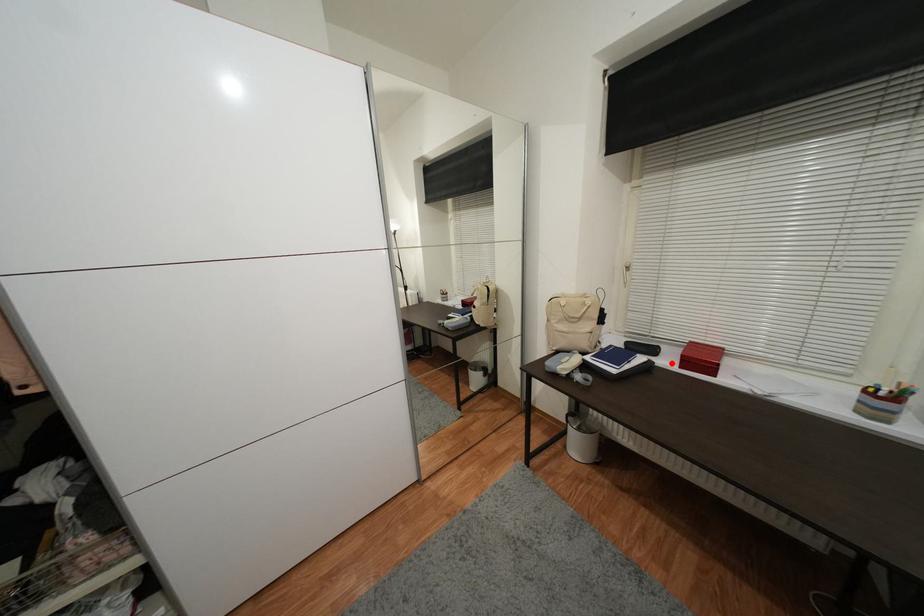
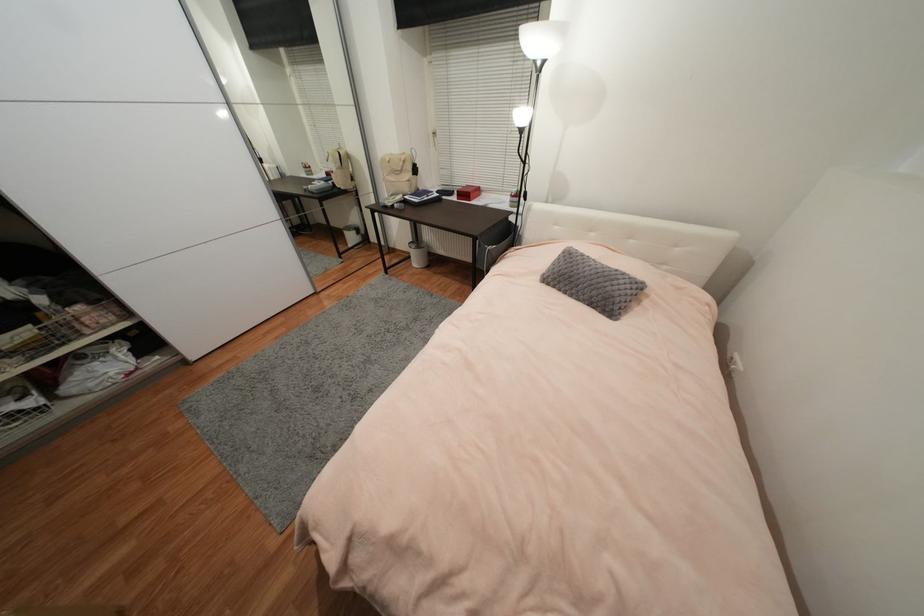
Locate, in the second image, the point that corresponds to the highlighted location in the first image.

(458, 199)